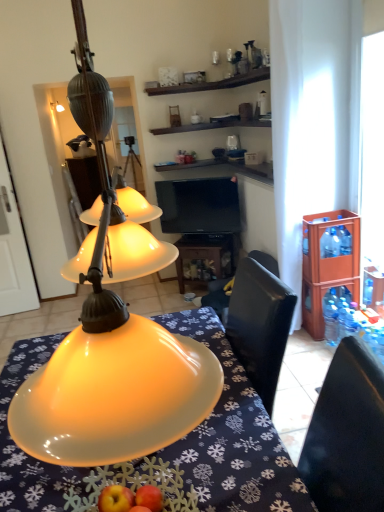
Question: From the image's perspective, is clear plastic bottle at right, the 3th bottle positioned from the bottom, located beneath brown wooden cabinet at right?

Choices:
 (A) no
 (B) yes

Answer: (A)

Question: From the image's perspective, is clear plastic bottle at right, the 3th bottle positioned from the bottom, over brown wooden cabinet at right?

Choices:
 (A) no
 (B) yes

Answer: (B)

Question: From a real-world perspective, is clear plastic bottle at right, arranged as the 1th bottle when viewed from the top, positioned under brown wooden cabinet at right based on gravity?

Choices:
 (A) yes
 (B) no

Answer: (B)

Question: From a real-world perspective, is clear plastic bottle at right, the 3th bottle positioned from the bottom, on brown wooden cabinet at right?

Choices:
 (A) no
 (B) yes

Answer: (B)

Question: Does clear plastic bottle at right, the 3th bottle positioned from the bottom, lie behind brown wooden cabinet at right?

Choices:
 (A) no
 (B) yes

Answer: (B)

Question: Considering the relative sizes of clear plastic bottle at right, the 3th bottle positioned from the bottom, and brown wooden cabinet at right in the image provided, is clear plastic bottle at right, the 3th bottle positioned from the bottom, taller than brown wooden cabinet at right?

Choices:
 (A) no
 (B) yes

Answer: (A)

Question: Is matte yellow lampshade at center surrounding transparent plastic bottle at right, which appears as the third bottle when viewed from the top?

Choices:
 (A) yes
 (B) no

Answer: (B)

Question: From the image's perspective, does matte yellow lampshade at center appear higher than transparent plastic bottle at right, which appears as the third bottle when viewed from the top?

Choices:
 (A) no
 (B) yes

Answer: (A)

Question: Is matte yellow lampshade at center thinner than transparent plastic bottle at right, which appears as the third bottle when viewed from the top?

Choices:
 (A) yes
 (B) no

Answer: (B)

Question: From a real-world perspective, is matte yellow lampshade at center located higher than transparent plastic bottle at right, which is counted as the first bottle, starting from the bottom?

Choices:
 (A) no
 (B) yes

Answer: (B)

Question: Is matte yellow lampshade at center completely or partially outside of transparent plastic bottle at right, which appears as the third bottle when viewed from the top?

Choices:
 (A) no
 (B) yes

Answer: (B)

Question: From a real-world perspective, is matte yellow lampshade at center located beneath transparent plastic bottle at right, which is counted as the first bottle, starting from the bottom?

Choices:
 (A) yes
 (B) no

Answer: (B)

Question: From a real-world perspective, is black glossy tv at center physically above blue plastic bottles at right, the 2th bottle when ordered from top to bottom?

Choices:
 (A) yes
 (B) no

Answer: (A)